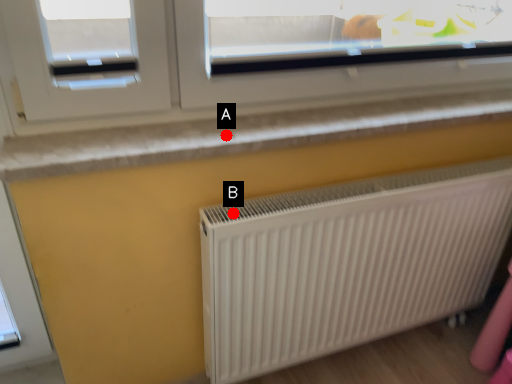
Question: Two points are circled on the image, labeled by A and B beside each circle. Which point is closer to the camera?

Choices:
 (A) A is closer
 (B) B is closer

Answer: (B)